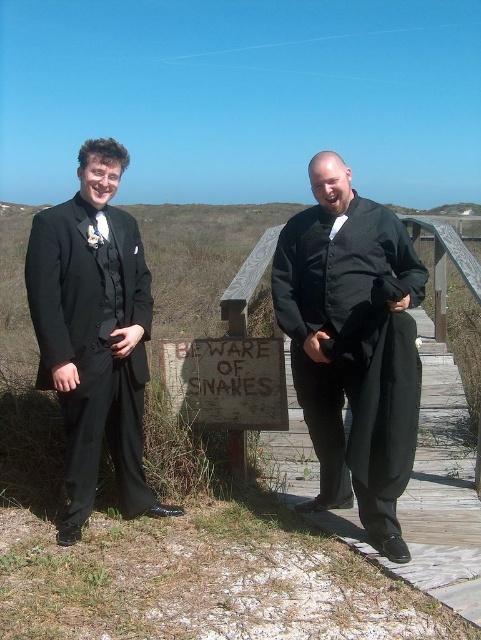
You are a photographer trying to capture a candid shot of the two people in the scene. The camera you are using has a narrow field of view that can only capture objects within a 0.5x0.5 meter area. Given that the black satin suit at center is located at point 0.539,0.734, can you determine if the camera can capture both individuals in a single frame?

The black satin suit at center is positioned at coordinates (353, 344). Since the camera has a narrow field of view of 0.5x0.5 meters, it is unlikely to capture both individuals in a single frame unless they are very close together. However, the description does not provide the exact positions of the other person or the distance between them. Therefore, it is impossible to determine with certainty.

You are a photographer trying to capture a candid shot of the matte black suit at left and the weathered wooden sign at center. Since you want to ensure both are in focus, which object should you focus on first to maintain depth of field?

You should focus on the weathered wooden sign at center first because the matte black suit at left is closer to the viewer, so focusing on the farther object ensures the depth of field will include both.

You are a photographer trying to capture a candid shot of the two people in the black satin suit at center and the weathered wooden sign at center. Since the sign is between them, can you adjust your camera angle to focus on the suit without the sign blocking the view?

The black satin suit at center is located above the weathered wooden sign at center, so yes, you can adjust your camera angle to focus on the suit without the sign blocking the view by aiming slightly upward.